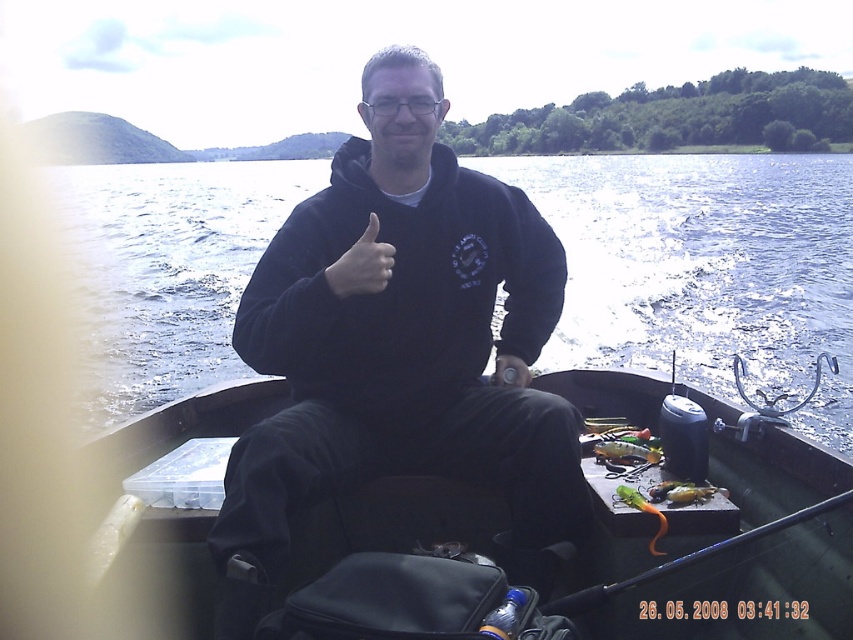
Question: Can you confirm if black matte boat at center is positioned to the left of orange rubber fishing pole at center?

Choices:
 (A) yes
 (B) no

Answer: (A)

Question: Which of the following is the farthest from the observer?

Choices:
 (A) (846, 492)
 (B) (662, 529)
 (C) (312, 349)

Answer: (C)

Question: Based on their relative distances, which object is nearer to the shiny metallic lure at center?

Choices:
 (A) black matte hoodie at center
 (B) clear water at center

Answer: (A)

Question: From the image, what is the correct spatial relationship of shiny metallic lure at center in relation to green rubber fish at lower center?

Choices:
 (A) right
 (B) left

Answer: (A)

Question: Can you confirm if black matte hoodie at center is thinner than green rubber fish at lower center?

Choices:
 (A) no
 (B) yes

Answer: (A)

Question: Which point is closer to the camera?

Choices:
 (A) (212, 224)
 (B) (602, 442)
 (C) (755, 556)

Answer: (C)